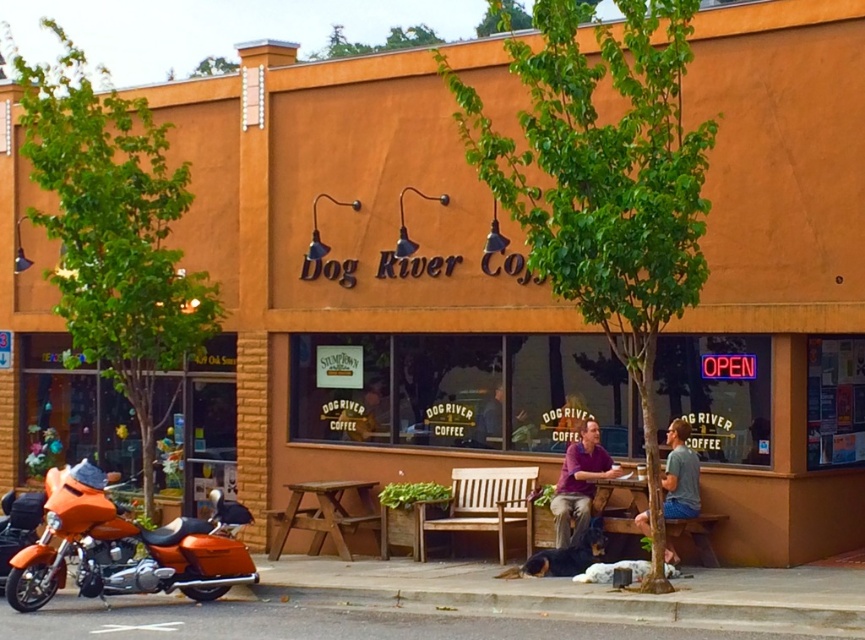
You are a delivery person who needs to park your motorcycle in the parking spot next to the orange matte motorcycle at lower left. The parking spot is only wide enough for vehicles narrower than the purple matte shirt at center. Can your motorcycle fit?

The orange matte motorcycle at lower left might be wider than the purple matte shirt at center. Since the parking spot is only wide enough for vehicles narrower than the purple matte shirt at center, there is uncertainty whether the orange matte motorcycle at lower left will fit.

From the picture: You are standing in front of Dog River Coffee and want to take a photo of the neon OPEN sign and the two people sitting at the table. The neon sign is at point (588,492) and the people are at point (460,477). Which point should you focus on first to ensure both are in focus?

You should focus on point (460,477) first because it is closer to you than point (588,492), which is further away. By focusing on the closer point, the depth of field may include both subjects in focus.